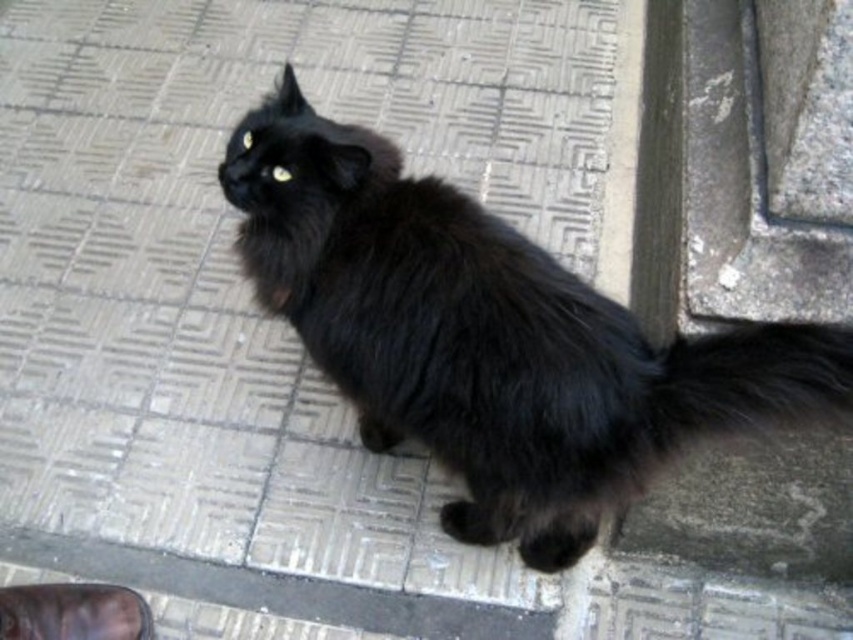
Question: Does black fluffy cat at center have a lesser width compared to leather shoe at lower left?

Choices:
 (A) yes
 (B) no

Answer: (B)

Question: Considering the relative positions of black fluffy tail at lower right and leather shoe at lower left in the image provided, where is black fluffy tail at lower right located with respect to leather shoe at lower left?

Choices:
 (A) right
 (B) left

Answer: (A)

Question: Which of the following is the closest to the observer?

Choices:
 (A) black fluffy tail at lower right
 (B) black fluffy cat at center
 (C) leather shoe at lower left

Answer: (A)

Question: Where is black fluffy tail at lower right located in relation to leather shoe at lower left in the image?

Choices:
 (A) left
 (B) right

Answer: (B)

Question: Among these points, which one is farthest from the camera?

Choices:
 (A) (613, 488)
 (B) (99, 600)
 (C) (691, 436)

Answer: (B)

Question: Which point is closer to the camera?

Choices:
 (A) black fluffy cat at center
 (B) leather shoe at lower left
 (C) black fluffy tail at lower right

Answer: (C)